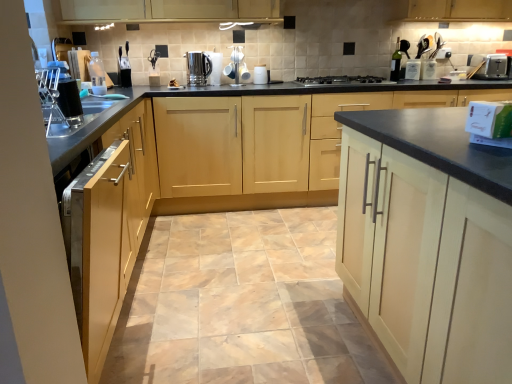
Question: Is black matte gas stove at center oriented away from satin silver kettle at center?

Choices:
 (A) no
 (B) yes

Answer: (A)

Question: Can you see black matte gas stove at center touching satin silver kettle at center?

Choices:
 (A) no
 (B) yes

Answer: (A)

Question: Can you confirm if black matte gas stove at center is thinner than satin silver kettle at center?

Choices:
 (A) yes
 (B) no

Answer: (B)

Question: Would you consider black matte gas stove at center to be distant from satin silver kettle at center?

Choices:
 (A) yes
 (B) no

Answer: (B)

Question: Is black matte gas stove at center surrounding satin silver kettle at center?

Choices:
 (A) yes
 (B) no

Answer: (B)

Question: Is white glossy mugs at center, acting as the first appliance starting from the left, situated inside natural stone floor at center or outside?

Choices:
 (A) outside
 (B) inside

Answer: (A)

Question: In terms of width, does white glossy mugs at center, the first appliance from the front, look wider or thinner when compared to natural stone floor at center?

Choices:
 (A) wide
 (B) thin

Answer: (B)

Question: Considering the relative positions of white glossy mugs at center, the second appliance viewed from the right, and natural stone floor at center in the image provided, is white glossy mugs at center, the second appliance viewed from the right, to the left or to the right of natural stone floor at center?

Choices:
 (A) left
 (B) right

Answer: (A)

Question: Is point (234, 51) closer or farther from the camera than point (159, 286)?

Choices:
 (A) closer
 (B) farther

Answer: (B)

Question: Is natural stone floor at center spatially inside green glass bottle at upper right, which is the second bottle in left-to-right order, or outside of it?

Choices:
 (A) inside
 (B) outside

Answer: (B)

Question: Is natural stone floor at center taller or shorter than green glass bottle at upper right, which is the second bottle in left-to-right order?

Choices:
 (A) tall
 (B) short

Answer: (B)

Question: Based on their positions, is natural stone floor at center located to the left or right of green glass bottle at upper right, which is the second bottle in left-to-right order?

Choices:
 (A) left
 (B) right

Answer: (A)

Question: Considering the positions of point (291, 263) and point (399, 66), is point (291, 263) closer or farther from the camera than point (399, 66)?

Choices:
 (A) farther
 (B) closer

Answer: (B)

Question: Is point (502, 57) positioned closer to the camera than point (482, 344)?

Choices:
 (A) closer
 (B) farther

Answer: (B)

Question: Visually, is metallic silver toaster at upper right, positioned as the first appliance in back-to-front order, positioned to the left or to the right of light wood cabinet at right, which is the third cabinetry in left-to-right order?

Choices:
 (A) left
 (B) right

Answer: (B)